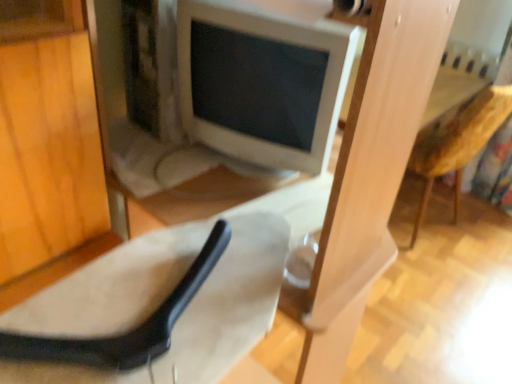
What do you see at coordinates (229, 303) in the screenshot? I see `suede-like beige chair at lower left` at bounding box center [229, 303].

The height and width of the screenshot is (384, 512). What do you see at coordinates (262, 82) in the screenshot?
I see `white glossy computer monitor at center` at bounding box center [262, 82].

Locate an element on the screen. suede-like beige chair at lower left is located at coordinates click(x=229, y=303).

Considering the sizes of objects wooden textured armchair at right and suede-like beige chair at lower left in the image provided, who is bigger, wooden textured armchair at right or suede-like beige chair at lower left?

wooden textured armchair at right is bigger.

From the image's perspective, is wooden textured armchair at right located above or below suede-like beige chair at lower left?

Clearly, from the image's perspective, wooden textured armchair at right is above suede-like beige chair at lower left.

Is the depth of wooden textured armchair at right greater than that of suede-like beige chair at lower left?

Yes, wooden textured armchair at right is further from the viewer.

Is point (480, 134) farther from camera compared to point (165, 373)?

Yes, it is.

Does suede-like beige chair at lower left appear on the right side of white glossy computer monitor at center?

No.

Would you say suede-like beige chair at lower left contains white glossy computer monitor at center?

No, white glossy computer monitor at center is not inside suede-like beige chair at lower left.

Is suede-like beige chair at lower left positioned with its back to white glossy computer monitor at center?

suede-like beige chair at lower left does not have its back to white glossy computer monitor at center.

From the image's perspective, would you say suede-like beige chair at lower left is shown under white glossy computer monitor at center?

Yes, from the image's perspective, suede-like beige chair at lower left is beneath white glossy computer monitor at center.

Which object is positioned more to the right, white glossy computer monitor at center or wooden textured armchair at right?

Positioned to the right is wooden textured armchair at right.

Based on the photo, considering the sizes of objects white glossy computer monitor at center and wooden textured armchair at right in the image provided, who is bigger, white glossy computer monitor at center or wooden textured armchair at right?

Bigger between the two is wooden textured armchair at right.

Which point is more forward, (316, 139) or (407, 167)?

The point (316, 139) is closer to the camera.

Which is behind, white glossy computer monitor at center or wooden textured armchair at right?

wooden textured armchair at right is further from the camera.

Considering the sizes of white glossy computer monitor at center and suede-like beige chair at lower left in the image, is white glossy computer monitor at center taller or shorter than suede-like beige chair at lower left?

Clearly, white glossy computer monitor at center is taller compared to suede-like beige chair at lower left.

Considering the sizes of objects white glossy computer monitor at center and suede-like beige chair at lower left in the image provided, who is thinner, white glossy computer monitor at center or suede-like beige chair at lower left?

suede-like beige chair at lower left.

Where is `computer monitor lying on the right of suede-like beige chair at lower left`? This screenshot has width=512, height=384. computer monitor lying on the right of suede-like beige chair at lower left is located at coordinates (262, 82).

From the picture: Measure the distance between white glossy computer monitor at center and suede-like beige chair at lower left.

white glossy computer monitor at center and suede-like beige chair at lower left are 16.06 inches apart.

In terms of width, does wooden textured armchair at right look wider or thinner when compared to white glossy computer monitor at center?

wooden textured armchair at right is wider than white glossy computer monitor at center.

Is wooden textured armchair at right inside or outside of white glossy computer monitor at center?

wooden textured armchair at right cannot be found inside white glossy computer monitor at center.

Is wooden textured armchair at right facing towards white glossy computer monitor at center?

No.

Can you confirm if wooden textured armchair at right is positioned to the right of white glossy computer monitor at center?

Yes, wooden textured armchair at right is to the right of white glossy computer monitor at center.

Is suede-like beige chair at lower left taller or shorter than wooden textured armchair at right?

Clearly, suede-like beige chair at lower left is shorter compared to wooden textured armchair at right.

From a real-world perspective, is suede-like beige chair at lower left positioned above or below wooden textured armchair at right?

From a real-world perspective, suede-like beige chair at lower left is physically above wooden textured armchair at right.

Who is bigger, suede-like beige chair at lower left or wooden textured armchair at right?

wooden textured armchair at right.

Considering the sizes of suede-like beige chair at lower left and wooden textured armchair at right in the image, is suede-like beige chair at lower left wider or thinner than wooden textured armchair at right?

Considering their sizes, suede-like beige chair at lower left looks slimmer than wooden textured armchair at right.

Identify the location of chair lying in front of the wooden textured armchair at right. (229, 303).

This screenshot has width=512, height=384. I want to click on computer monitor above the suede-like beige chair at lower left (from the image's perspective), so click(x=262, y=82).

From the image, which object appears to be farther from wooden textured armchair at right, white glossy computer monitor at center or suede-like beige chair at lower left?

The object further to wooden textured armchair at right is suede-like beige chair at lower left.

Estimate the real-world distances between objects in this image. Which object is closer to suede-like beige chair at lower left, white glossy computer monitor at center or wooden textured armchair at right?

white glossy computer monitor at center lies closer to suede-like beige chair at lower left than the other object.

Considering their positions, is suede-like beige chair at lower left positioned closer to wooden textured armchair at right than white glossy computer monitor at center?

white glossy computer monitor at center is closer to wooden textured armchair at right.

Which object lies further to the anchor point white glossy computer monitor at center, wooden textured armchair at right or suede-like beige chair at lower left?

The object further to white glossy computer monitor at center is wooden textured armchair at right.

Looking at the image, which one is located closer to white glossy computer monitor at center, suede-like beige chair at lower left or wooden textured armchair at right?

Based on the image, suede-like beige chair at lower left appears to be nearer to white glossy computer monitor at center.

Considering their positions, is wooden textured armchair at right positioned closer to suede-like beige chair at lower left than white glossy computer monitor at center?

white glossy computer monitor at center is positioned closer to the anchor suede-like beige chair at lower left.

You are a GUI agent. You are given a task and a screenshot of the screen. Output one action in this format:
    pyautogui.click(x=<x>, y=<y>)
    Task: Click on the computer monitor between suede-like beige chair at lower left and wooden textured armchair at right from front to back
    Image resolution: width=512 pixels, height=384 pixels.
    Given the screenshot: What is the action you would take?
    pyautogui.click(x=262, y=82)